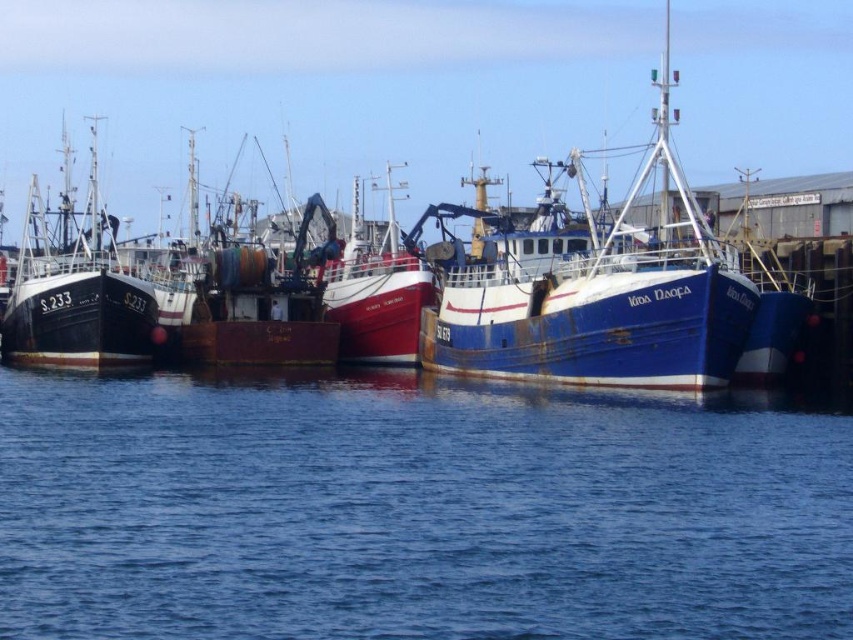
Question: Which of the following is the farthest from the observer?

Choices:
 (A) blue rusty boat at center
 (B) black matte boat at left
 (C) blue water at center
 (D) rusty metal boat at center

Answer: (D)

Question: Which point is farther to the camera?

Choices:
 (A) black matte boat at left
 (B) blue water at center
 (C) blue rusty boat at center

Answer: (A)

Question: Is blue water at center closer to camera compared to blue rusty boat at center?

Choices:
 (A) yes
 (B) no

Answer: (A)

Question: Which point is farther from the camera taking this photo?

Choices:
 (A) (100, 388)
 (B) (572, 301)
 (C) (51, 280)
 (D) (262, 269)

Answer: (D)

Question: Is blue rusty boat at center to the right of rusty metal boat at center from the viewer's perspective?

Choices:
 (A) no
 (B) yes

Answer: (B)

Question: From the image, what is the correct spatial relationship of blue water at center in relation to rusty metal boat at center?

Choices:
 (A) right
 (B) left

Answer: (A)